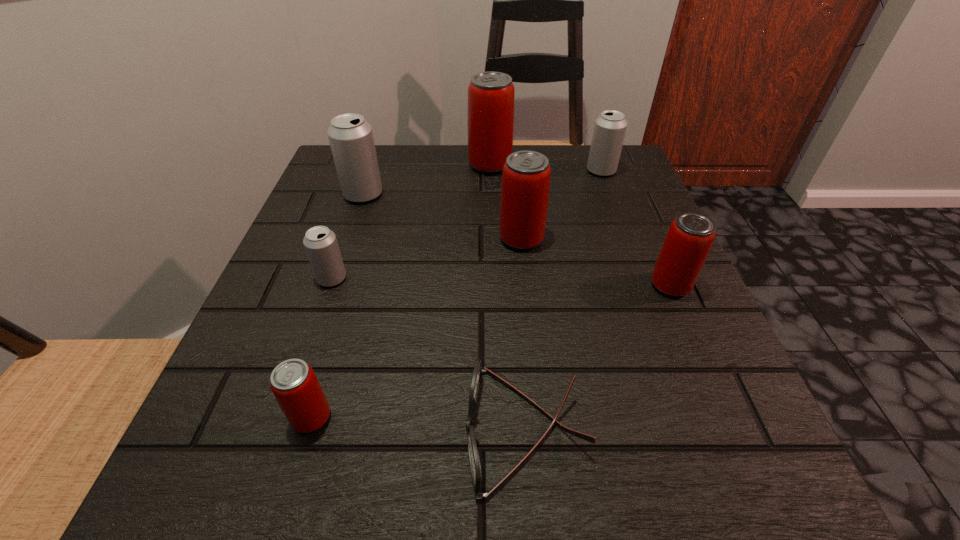
Locate an element on the screen. vacant area situated on the back of the leftmost pink beer can is located at coordinates (357, 264).

Find the location of a particular element. The height and width of the screenshot is (540, 960). free location located 0.050m on the front-facing side of the shortest object is located at coordinates (426, 429).

Locate an element on the screen. The height and width of the screenshot is (540, 960). free space located on the front-facing side of the shortest object is located at coordinates (198, 429).

Find the location of `vacant space located 0.070m on the front-facing side of the shortest object`. vacant space located 0.070m on the front-facing side of the shortest object is located at coordinates (411, 429).

Locate an element on the screen. This screenshot has height=540, width=960. object located in the near edge section of the desktop is located at coordinates (475, 467).

Identify the location of object located in the far left corner section of the desktop. (351, 139).

Where is `object at the far right corner`? object at the far right corner is located at coordinates click(x=609, y=131).

Where is `vacant space at the far edge`? This screenshot has height=540, width=960. vacant space at the far edge is located at coordinates point(460,191).

In the image, there is a desktop. Identify the location of vacant area at the near edge. (626, 442).

Where is `blank space at the left edge`? blank space at the left edge is located at coordinates (265, 334).